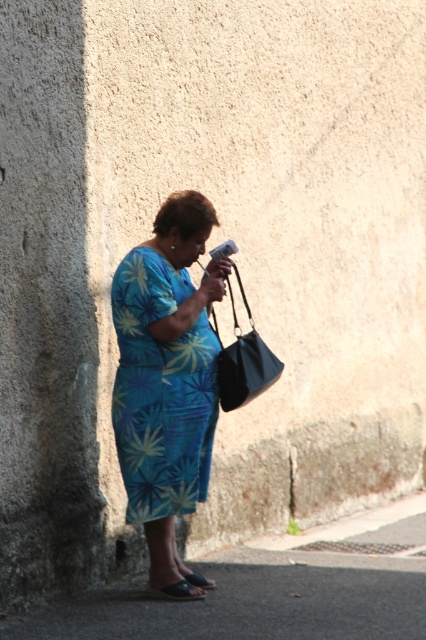
Question: Estimate the real-world distances between objects in this image. Which object is farther from the black fabric sandal at lower center?

Choices:
 (A) black leather bag at center
 (B) blue floral fabric dress at center
 (C) brown leather sandal at lower center

Answer: (A)

Question: Is black leather bag at center bigger than black fabric sandal at lower center?

Choices:
 (A) yes
 (B) no

Answer: (A)

Question: Which point is farther from the camera taking this photo?

Choices:
 (A) (167, 596)
 (B) (195, 408)

Answer: (A)

Question: Which is farther from the brown leather sandal at lower center?

Choices:
 (A) black fabric sandal at lower center
 (B) black leather bag at center

Answer: (B)

Question: Observing the image, what is the correct spatial positioning of blue floral fabric dress at center in reference to brown leather sandal at lower center?

Choices:
 (A) below
 (B) above

Answer: (B)

Question: Where is black leather bag at center located in relation to brown leather sandal at lower center in the image?

Choices:
 (A) left
 (B) right

Answer: (B)